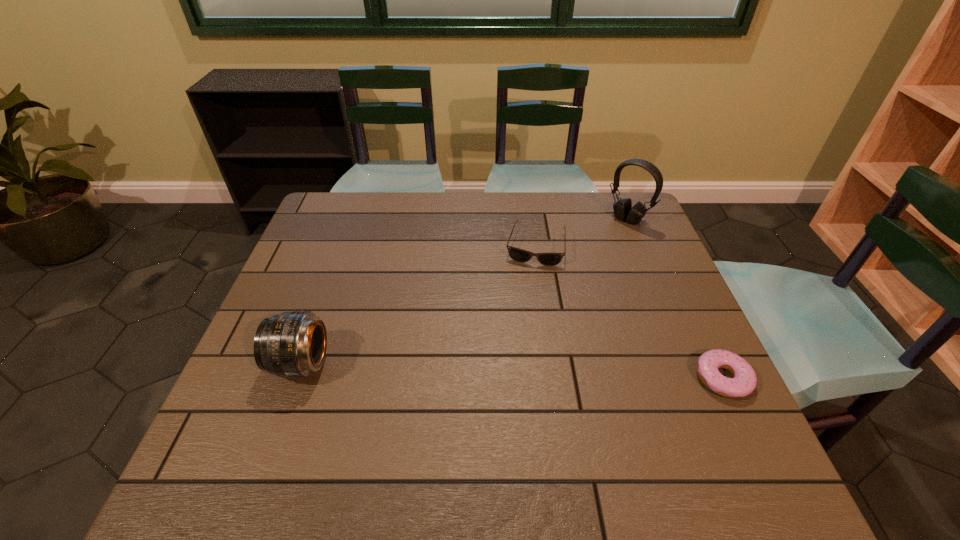
Where is `free space between the third shortest object and the headset`? free space between the third shortest object and the headset is located at coordinates (465, 292).

In order to click on vacant space that's between the leftmost object and the shortest object in this screenshot , I will do `click(512, 371)`.

The width and height of the screenshot is (960, 540). In order to click on vacant space that is in between the tallest object and the shortest object in this screenshot , I will do `click(675, 299)`.

Locate an element on the screen. Image resolution: width=960 pixels, height=540 pixels. unoccupied position between the second object from left to right and the shortest object is located at coordinates (629, 312).

Where is `free space between the tallest object and the shortest object`? The height and width of the screenshot is (540, 960). free space between the tallest object and the shortest object is located at coordinates (675, 299).

Where is `free point between the doughnut and the sunglasses`? The height and width of the screenshot is (540, 960). free point between the doughnut and the sunglasses is located at coordinates (629, 312).

This screenshot has width=960, height=540. Identify the location of empty space that is in between the headset and the second tallest object. (465, 292).

Find the location of `vacant area that lies between the tallest object and the leftmost object`. vacant area that lies between the tallest object and the leftmost object is located at coordinates (465, 292).

Identify the location of free space between the leftmost object and the headset. This screenshot has width=960, height=540. (465, 292).

Identify the location of the second closest object relative to the telephoto lens. (744, 382).